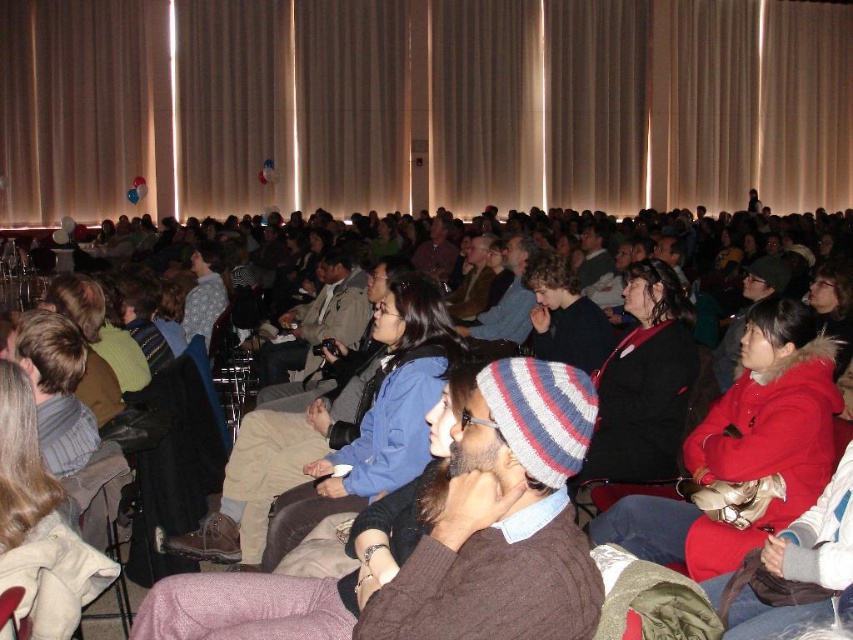
You are sitting in the audience of this conference hall and notice two hats at the center. Which hat is closer to you, the knitted wool beanie at center or the dark blue knit hat at center?

The knitted wool beanie at center is closer to you because it is in front of the dark blue knit hat at center.

You are an event photographer at the front of the stage. You notice two hats at the center of the audience. Which hat is closer to the stage, the dark blue knit hat at center or the striped knit beanie at center?

The dark blue knit hat at center is positioned under the striped knit beanie at center, meaning it is closer to the stage.

You are an attendee at the event and want to take a photo of the knitted wool beanie at center and the red fuzzy coat at center. Which one is closer to the camera?

The knitted wool beanie at center is below the red fuzzy coat at center, so the red fuzzy coat at center is closer to the camera.